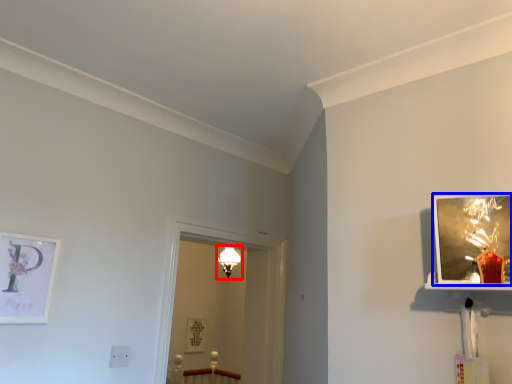
Question: Among these objects, which one is farthest to the camera, light fixture (highlighted by a red box) or picture frame (highlighted by a blue box)?

Choices:
 (A) light fixture
 (B) picture frame

Answer: (A)